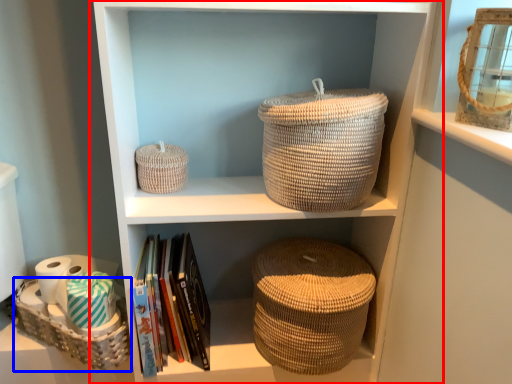
Question: Among these objects, which one is nearest to the camera, shelf (highlighted by a red box) or basket (highlighted by a blue box)?

Choices:
 (A) shelf
 (B) basket

Answer: (A)